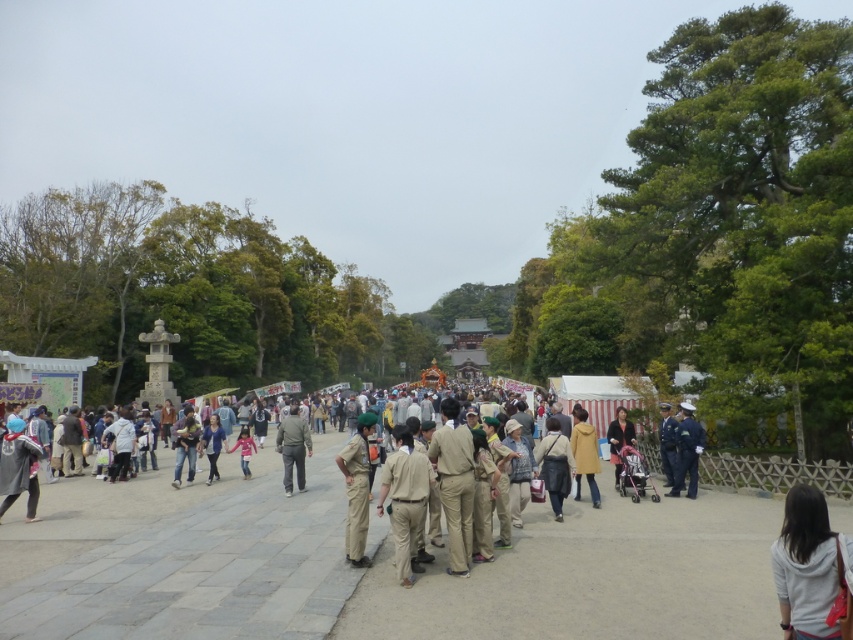
What do you see at coordinates (404, 500) in the screenshot? I see `khaki uniform pants at center` at bounding box center [404, 500].

Is point (419, 508) closer to camera compared to point (28, 509)?

That is True.

This screenshot has height=640, width=853. I want to click on khaki uniform pants at center, so click(x=404, y=500).

Who is more forward, (548,476) or (573,445)?

Point (548,476)

Is matte brown coat at center below light brown fabric coat at center?

Actually, matte brown coat at center is above light brown fabric coat at center.

Between point (534, 454) and point (585, 419), which one is positioned in front?

Positioned in front is point (534, 454).

Image resolution: width=853 pixels, height=640 pixels. Identify the location of matte brown coat at center. pos(555,465).

Can you confirm if khaki uniform at center is positioned to the right of matte brown coat at center?

No, khaki uniform at center is not to the right of matte brown coat at center.

Between point (364, 416) and point (547, 429), which one is positioned in front?

Positioned in front is point (364, 416).

Where is `khaki uniform at center`? khaki uniform at center is located at coordinates (357, 488).